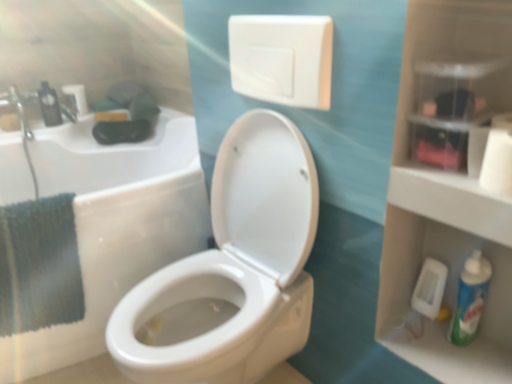
Question: Can you confirm if green plastic mouthwash at lower right, positioned as the second mouthwash in left-to-right order, is thinner than black plastic mouthwash at left, the second mouthwash when ordered from front to back?

Choices:
 (A) no
 (B) yes

Answer: (B)

Question: From the image's perspective, would you say green plastic mouthwash at lower right, which is the 1th mouthwash from front to back, is positioned over black plastic mouthwash at left, the 2th mouthwash from the bottom?

Choices:
 (A) no
 (B) yes

Answer: (A)

Question: Could you tell me if green plastic mouthwash at lower right, placed as the second mouthwash when sorted from top to bottom, is facing black plastic mouthwash at left, acting as the first mouthwash starting from the top?

Choices:
 (A) yes
 (B) no

Answer: (B)

Question: Does green plastic mouthwash at lower right, placed as the second mouthwash when sorted from top to bottom, have a greater height compared to black plastic mouthwash at left, the second mouthwash when ordered from front to back?

Choices:
 (A) no
 (B) yes

Answer: (B)

Question: Considering the relative positions of green plastic mouthwash at lower right, placed as the second mouthwash when sorted from top to bottom, and black plastic mouthwash at left, the second mouthwash when ordered from front to back, in the image provided, is green plastic mouthwash at lower right, placed as the second mouthwash when sorted from top to bottom, behind black plastic mouthwash at left, the second mouthwash when ordered from front to back,?

Choices:
 (A) yes
 (B) no

Answer: (B)

Question: Is green plastic mouthwash at lower right, marked as the first mouthwash in a bottom-to-top arrangement, positioned in front of black plastic mouthwash at left, the second mouthwash when ordered from front to back?

Choices:
 (A) yes
 (B) no

Answer: (A)

Question: Is the position of black plastic mouthwash at left, the 2th mouthwash from the bottom, less distant than that of white glossy toilet at center?

Choices:
 (A) no
 (B) yes

Answer: (A)

Question: Does black plastic mouthwash at left, the 2th mouthwash positioned from the right, have a larger size compared to white glossy toilet at center?

Choices:
 (A) no
 (B) yes

Answer: (A)

Question: Is black plastic mouthwash at left, the second mouthwash when ordered from front to back, completely or partially outside of white glossy toilet at center?

Choices:
 (A) no
 (B) yes

Answer: (B)

Question: From a real-world perspective, is black plastic mouthwash at left, the second mouthwash when ordered from front to back, below white glossy toilet at center?

Choices:
 (A) yes
 (B) no

Answer: (B)

Question: From a real-world perspective, does black plastic mouthwash at left, the 2th mouthwash from the bottom, stand above white glossy toilet at center?

Choices:
 (A) no
 (B) yes

Answer: (B)

Question: Would you consider black plastic mouthwash at left, acting as the first mouthwash starting from the top, to be distant from white glossy toilet at center?

Choices:
 (A) no
 (B) yes

Answer: (B)

Question: From a real-world perspective, is white matte toilet paper at upper left, the first toilet paper from the top, located higher than white matte toilet paper at left, arranged as the third toilet paper when viewed from the right?

Choices:
 (A) yes
 (B) no

Answer: (A)